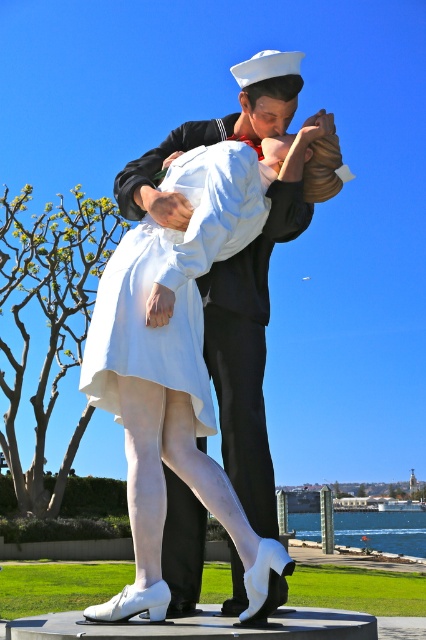
You are a photographer trying to capture a closeup of both the matte white dress at center and the white satin dress at center in the statue. If your camera can only focus on objects within a 10 inch range, will you be able to capture both dresses in one shot?

The matte white dress at center and white satin dress at center are 10.03 inches apart from each other. Since the distance between them exceeds the camera focus range of 10 inches, you may not be able to capture both dresses in one focused shot.

You are an art restorer examining the statue of two figures in a dynamic embrace. You notice two dresses at the center of the statue. Which dress is positioned lower on the female figure, the matte white dress at center or the white satin dress at center?

The matte white dress at center is positioned lower because it is below the white satin dress at center.